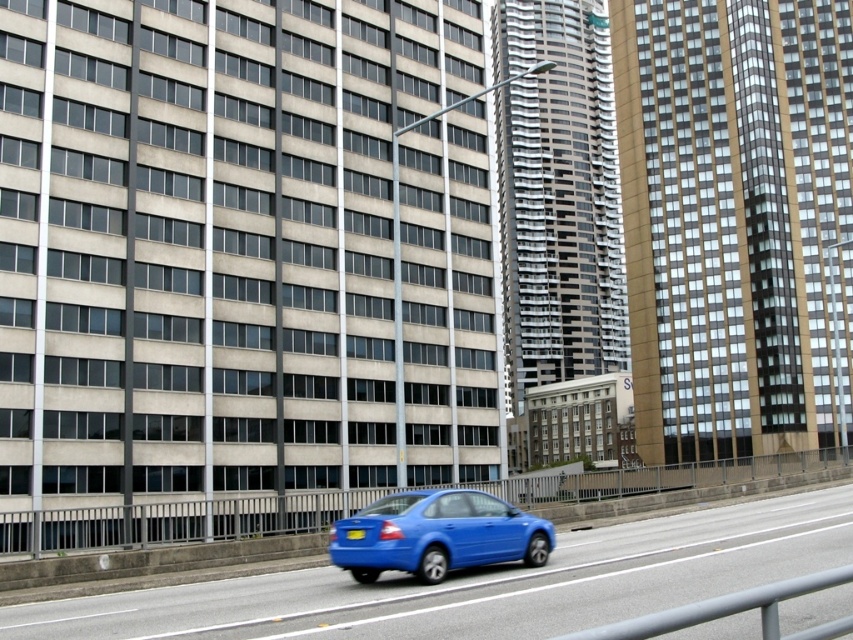
You are driving a glossy blue sedan at center and want to park it on the smooth asphalt highway at center. Is the highway under your car a suitable parking spot?

The smooth asphalt highway at center is positioned under the glossy blue sedan at center, so parking there would mean the car is already on the highway, which is not a safe or legal parking spot.

Looking at this image, you are a pedestrian standing on the sidewalk near the smooth asphalt highway at center. You see a glossy blue sedan at center approaching from the distance. Can you safely cross the highway before the car reaches you?

The smooth asphalt highway at center is closer to the viewer than the glossy blue sedan at center, so the glossy blue sedan at center is further away. Therefore, you have enough time to safely cross the highway before the car arrives.

You are driving a glossy blue sedan at center and want to park it on the smooth asphalt highway at center. Is the height of the highway sufficient to accommodate your vehicle?

The smooth asphalt highway at center has a greater height compared to the glossy blue sedan at center, so yes, the highway is tall enough to accommodate the vehicle.